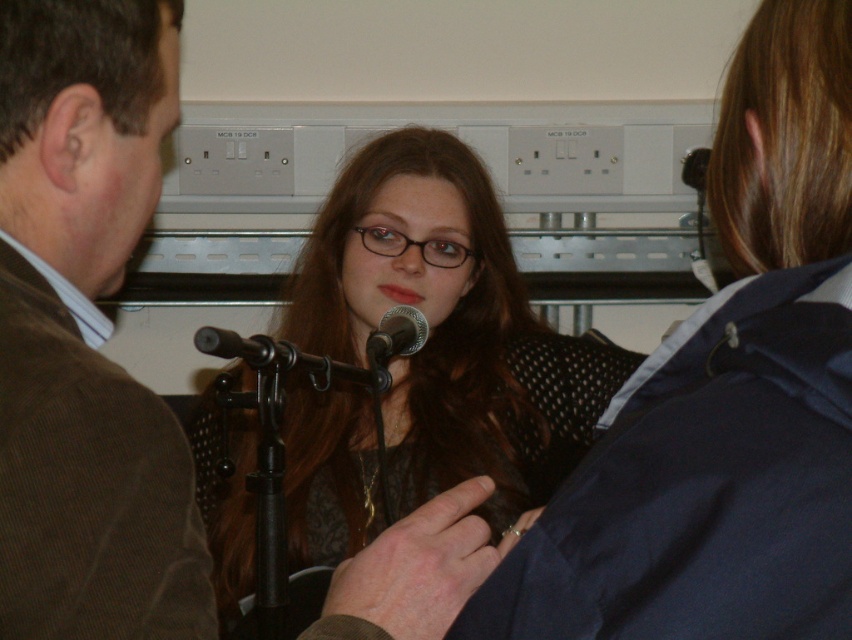
Who is taller, brown corduroy jacket at left or matte black microphone at center?

matte black microphone at center is taller.

Is brown corduroy jacket at left positioned before matte black microphone at center?

Yes, brown corduroy jacket at left is closer to the viewer.

You are a GUI agent. You are given a task and a screenshot of the screen. Output one action in this format:
    pyautogui.click(x=<x>, y=<y>)
    Task: Click on the brown corduroy jacket at left
    
    Given the screenshot: What is the action you would take?
    pyautogui.click(x=81, y=336)

You are a GUI agent. You are given a task and a screenshot of the screen. Output one action in this format:
    pyautogui.click(x=<x>, y=<y>)
    Task: Click on the brown corduroy jacket at left
    This screenshot has height=640, width=852.
    Given the screenshot: What is the action you would take?
    pyautogui.click(x=81, y=336)

Which is below, matte black microphone at center or metallic silver microphone at center?

matte black microphone at center

Does matte black microphone at center have a smaller size compared to metallic silver microphone at center?

Incorrect, matte black microphone at center is not smaller in size than metallic silver microphone at center.

Find the location of `matte black microphone at center`. matte black microphone at center is located at coordinates (403, 358).

Between black metallic microphone at center and metallic silver microphone at center, which one has more height?

black metallic microphone at center is taller.

Looking at this image, can you confirm if black metallic microphone at center is shorter than metallic silver microphone at center?

No.

The image size is (852, 640). I want to click on black metallic microphone at center, so click(x=295, y=360).

Identify the location of black metallic microphone at center. pyautogui.click(x=295, y=360).